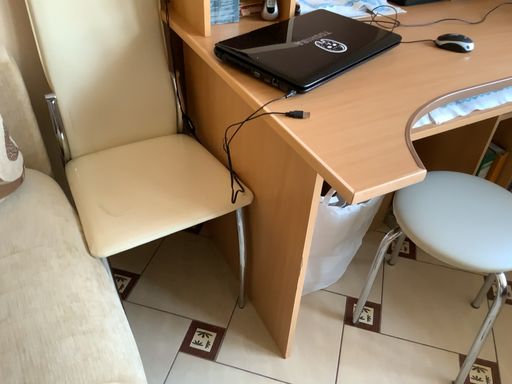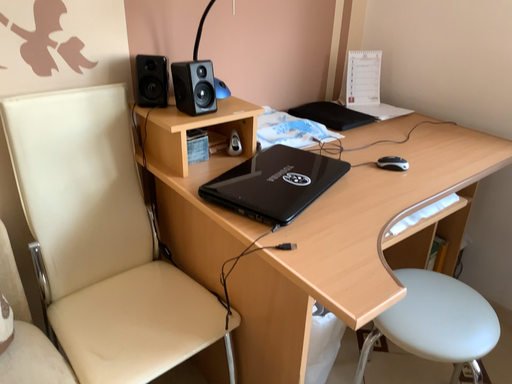
Question: Which way did the camera rotate in the video?

Choices:
 (A) rotated right
 (B) rotated left

Answer: (A)